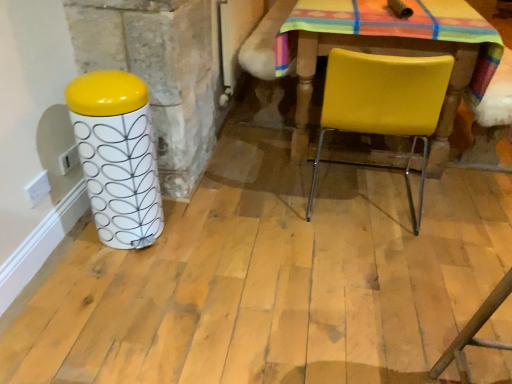
Identify the location of free location in front of white glossy patterned canister at left. This screenshot has width=512, height=384. (111, 272).